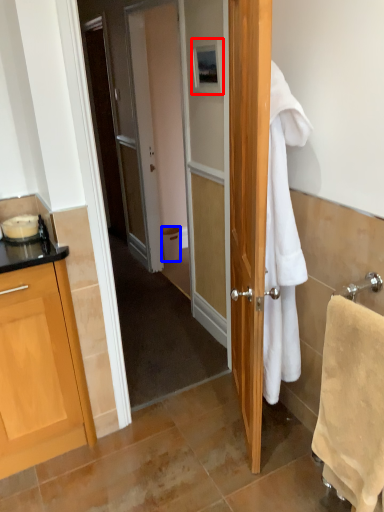
Question: Among these objects, which one is nearest to the camera, picture frame (highlighted by a red box) or trash bin/can (highlighted by a blue box)?

Choices:
 (A) picture frame
 (B) trash bin/can

Answer: (A)